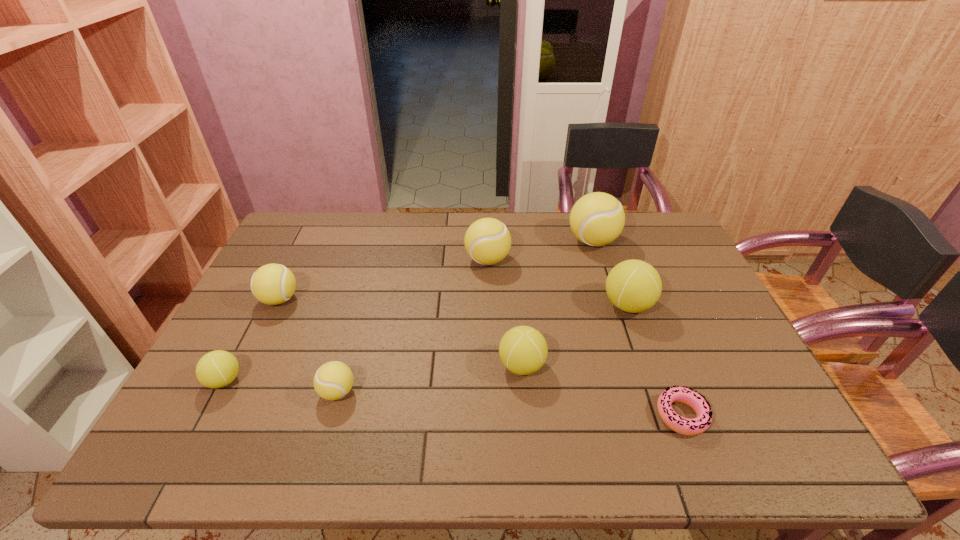
At what (x,y) coordinates should I click in order to perform the action: click on free space between the biggest green tennis ball and the smallest green tennis ball. Please return your answer as a coordinate pair (x, y). The image size is (960, 540). Looking at the image, I should click on (426, 343).

Locate an element on the screen. free space that is in between the biggest yellow tennis ball and the second biggest yellow tennis ball is located at coordinates (540, 251).

Where is `vacant region between the rightmost green tennis ball and the leftmost green tennis ball`? Image resolution: width=960 pixels, height=540 pixels. vacant region between the rightmost green tennis ball and the leftmost green tennis ball is located at coordinates (426, 343).

Locate an element on the screen. The height and width of the screenshot is (540, 960). free spot between the biggest green tennis ball and the sixth object from right to left is located at coordinates (483, 348).

In order to click on free area in between the nearest yellow tennis ball and the leftmost yellow tennis ball in this screenshot , I will do `click(309, 346)`.

Locate an element on the screen. The height and width of the screenshot is (540, 960). the sixth closest object to the second yellow tennis ball from right to left is located at coordinates (690, 427).

Select which object is the second closest to the second green tennis ball from right to left. Please provide its 2D coordinates. Your answer should be formatted as a tuple, i.e. [(x, y)], where the tuple contains the x and y coordinates of a point satisfying the conditions above.

[(690, 427)]

Choose which tennis ball is the fourth nearest neighbor to the tallest object. Please provide its 2D coordinates. Your answer should be formatted as a tuple, i.e. [(x, y)], where the tuple contains the x and y coordinates of a point satisfying the conditions above.

[(333, 380)]

Select which tennis ball appears as the fourth closest to the third object from left to right. Please provide its 2D coordinates. Your answer should be formatted as a tuple, i.e. [(x, y)], where the tuple contains the x and y coordinates of a point satisfying the conditions above.

[(487, 241)]

Select which yellow tennis ball is the second closest to the second yellow tennis ball from right to left. Please provide its 2D coordinates. Your answer should be formatted as a tuple, i.e. [(x, y)], where the tuple contains the x and y coordinates of a point satisfying the conditions above.

[(333, 380)]